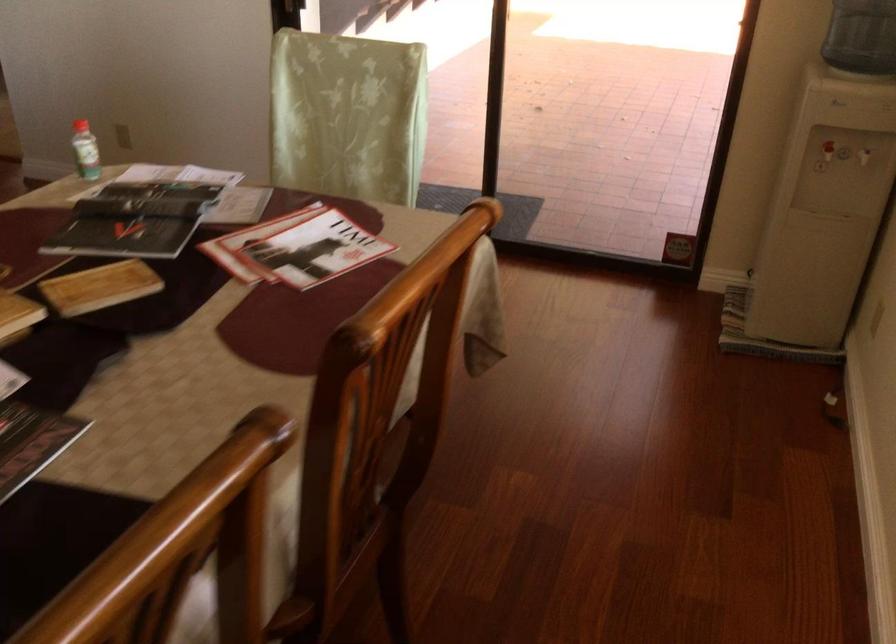
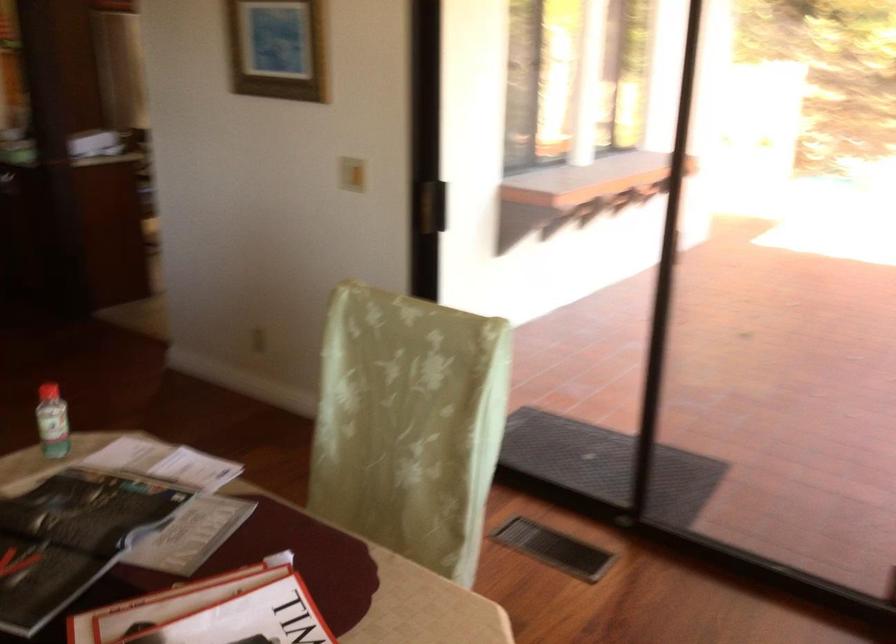
Question: The camera is either moving clockwise (left) or counter-clockwise (right) around the object. The first image is from the beginning of the video and the second image is from the end. Is the camera moving left or right when shooting the video?

Choices:
 (A) Left
 (B) Right

Answer: (B)